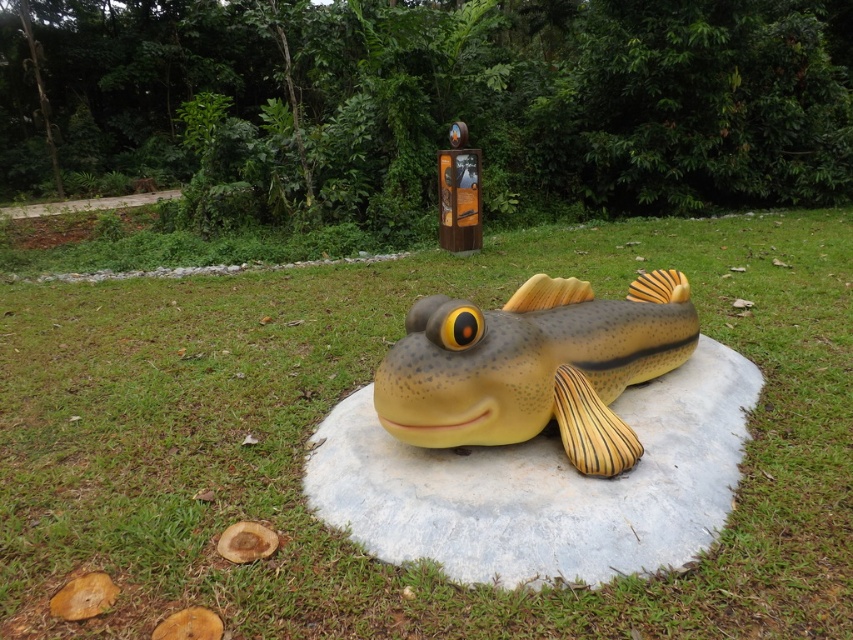
Does green grass at center have a greater width compared to matte yellow fish at center?

No, green grass at center is not wider than matte yellow fish at center.

Can you confirm if green grass at center is positioned above matte yellow fish at center?

No.

The height and width of the screenshot is (640, 853). Identify the location of green grass at center. [364, 381].

Identify the location of green grass at center. This screenshot has width=853, height=640. (364, 381).